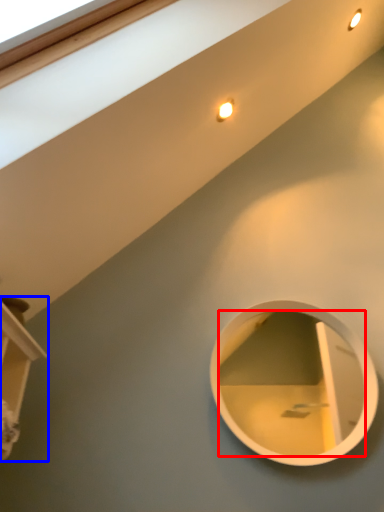
Question: Which object is closer to the camera taking this photo, mirror (highlighted by a red box) or shelf (highlighted by a blue box)?

Choices:
 (A) mirror
 (B) shelf

Answer: (B)